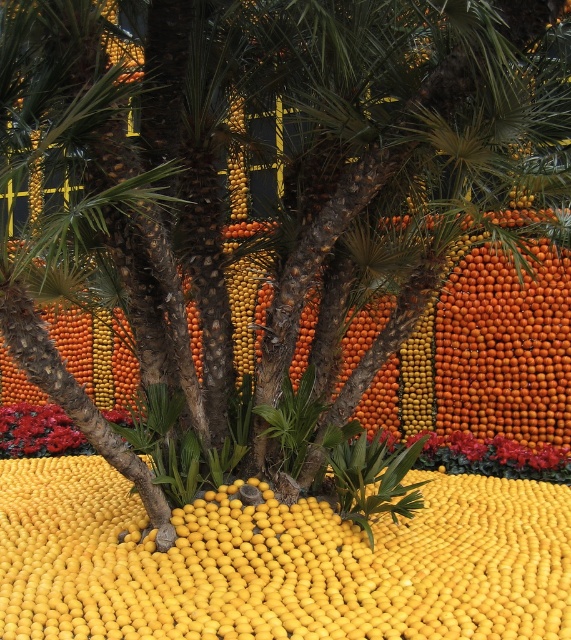
You are an artist planning to paint the scene. You want to ensure that the yellow matte lemon at center and the shiny red petals at lower left are proportionally accurate. Which object should you depict as taller in your painting?

The yellow matte lemon at center should be depicted as taller in the painting since it has a greater height compared to the shiny red petals at lower left according to the description.

You are an artist planning to paint the scene. You notice the yellow matte lemon at center and the shiny red petals at lower left. Which object is located above the other?

The yellow matte lemon at center is positioned over the shiny red petals at lower left.